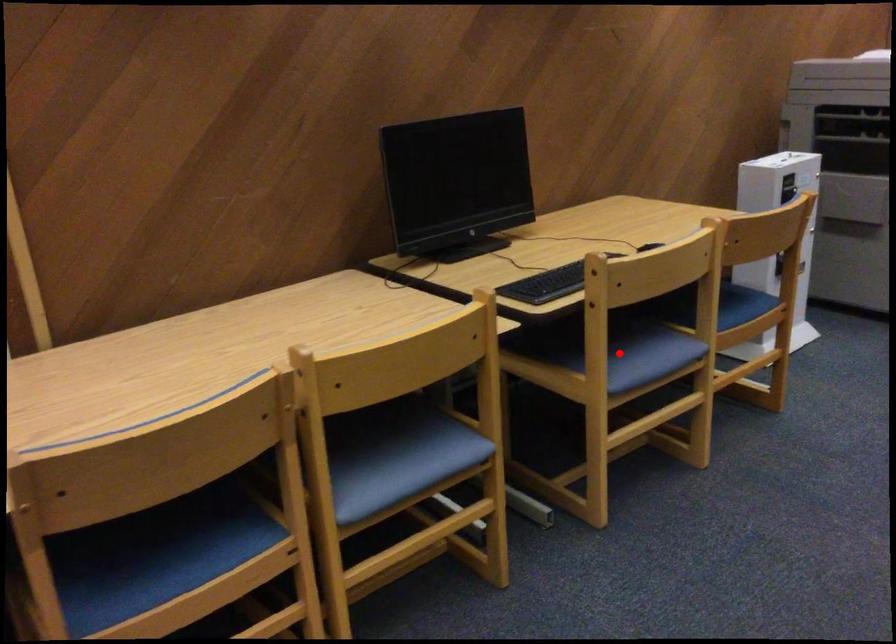
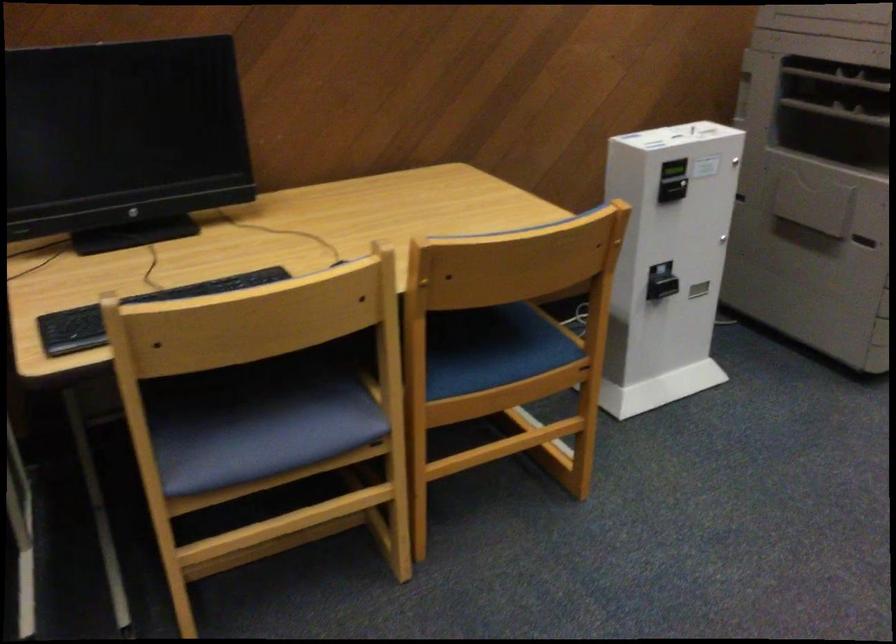
Question: I am providing you with two images of the same scene from different viewpoints. A red point is shown in image1. For the corresponding object point in image2, is it positioned nearer or farther from the camera?

Choices:
 (A) Nearer
 (B) Farther

Answer: (A)